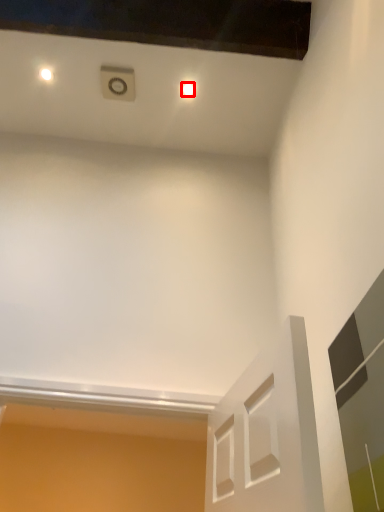
Question: From the image's perspective, where is dot (annotated by the red box) located relative to glass door?

Choices:
 (A) below
 (B) above

Answer: (B)